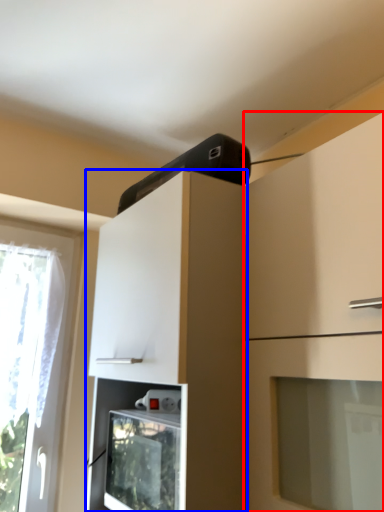
Question: Which of the following is the closest to the observer, cabinetry (highlighted by a red box) or cabinetry (highlighted by a blue box)?

Choices:
 (A) cabinetry
 (B) cabinetry

Answer: (A)